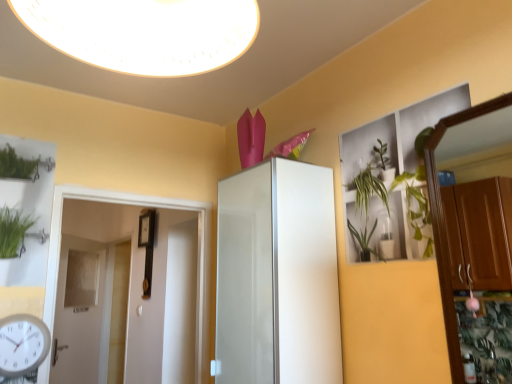
Question: Is white glossy light fixture at upper center closer to camera compared to white plastic clock at lower left?

Choices:
 (A) yes
 (B) no

Answer: (A)

Question: From a real-world perspective, is white glossy light fixture at upper center on top of white plastic clock at lower left?

Choices:
 (A) yes
 (B) no

Answer: (A)

Question: Could you tell me if white glossy light fixture at upper center is facing white plastic clock at lower left?

Choices:
 (A) yes
 (B) no

Answer: (B)

Question: Is white glossy light fixture at upper center positioned far away from white plastic clock at lower left?

Choices:
 (A) no
 (B) yes

Answer: (B)

Question: Is white glossy light fixture at upper center oriented away from white plastic clock at lower left?

Choices:
 (A) no
 (B) yes

Answer: (A)

Question: Is white glossy cabinet at center taller or shorter than white glossy light fixture at upper center?

Choices:
 (A) tall
 (B) short

Answer: (A)

Question: Looking at their shapes, would you say white glossy cabinet at center is wider or thinner than white glossy light fixture at upper center?

Choices:
 (A) thin
 (B) wide

Answer: (A)

Question: Considering the positions of point (289, 367) and point (70, 39), is point (289, 367) closer or farther from the camera than point (70, 39)?

Choices:
 (A) closer
 (B) farther

Answer: (B)

Question: Choose the correct answer: Is white glossy cabinet at center inside white glossy light fixture at upper center or outside it?

Choices:
 (A) inside
 (B) outside

Answer: (B)

Question: From a real-world perspective, is white plastic clock at lower left above or below white glossy light fixture at upper center?

Choices:
 (A) below
 (B) above

Answer: (A)

Question: In terms of size, does white plastic clock at lower left appear bigger or smaller than white glossy light fixture at upper center?

Choices:
 (A) big
 (B) small

Answer: (B)

Question: Considering their positions, is white plastic clock at lower left located in front of or behind white glossy light fixture at upper center?

Choices:
 (A) front
 (B) behind

Answer: (B)

Question: In the image, is white plastic clock at lower left on the left side or the right side of white glossy light fixture at upper center?

Choices:
 (A) right
 (B) left

Answer: (B)

Question: From a real-world perspective, relative to white glossy door at left, positioned as the 2th door in left-to-right order, is wooden dresser at right vertically above or below?

Choices:
 (A) above
 (B) below

Answer: (A)

Question: Is wooden dresser at right bigger or smaller than white glossy door at left, positioned as the 2th door in left-to-right order?

Choices:
 (A) big
 (B) small

Answer: (B)